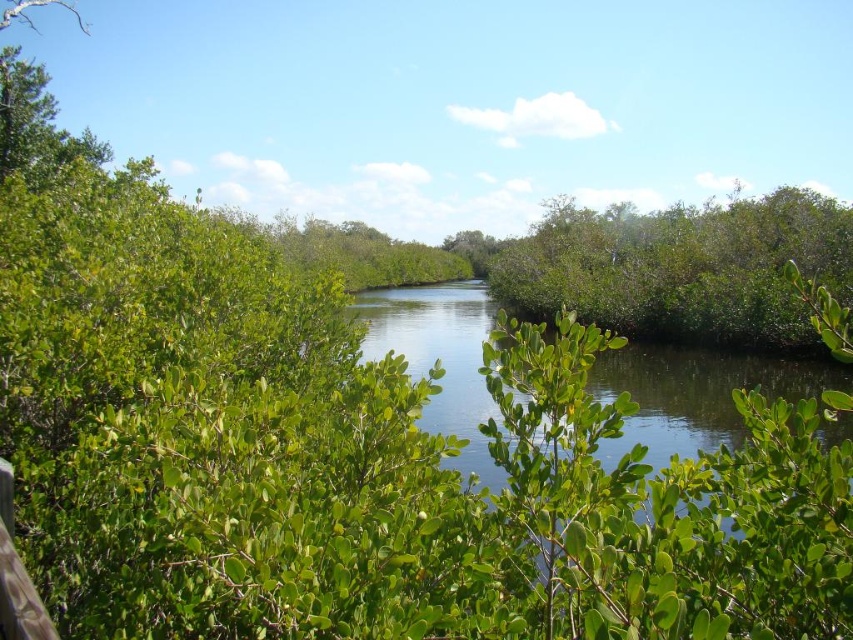
You are a small frog trying to jump from one leaf to another across the green leafy bush at center and the green leafy river at center. Which object would allow you to make a shorter jump?

The green leafy bush at center has a smaller width than the green leafy river at center, so the frog can make a shorter jump over the green leafy bush at center.

You are a drone operator trying to capture a photo of the green leafy bush at center. The camera is currently positioned at the origin point. What is the 2D coordinate where you should direct the camera to focus?

The green leafy bush at center is located at the 2D coordinate point of (682, 268). Therefore, the camera should be directed to focus at that coordinate to capture the bush.

You are a hiker who wants to cross the green leafy river at center without getting your shoes wet. There is a green leafy bush at center nearby. Can you use the bush to safely cross the river?

The green leafy bush at center is 9.02 meters away from the green leafy river at center. Since the distance is too large, you cannot use the bush to safely cross the river.